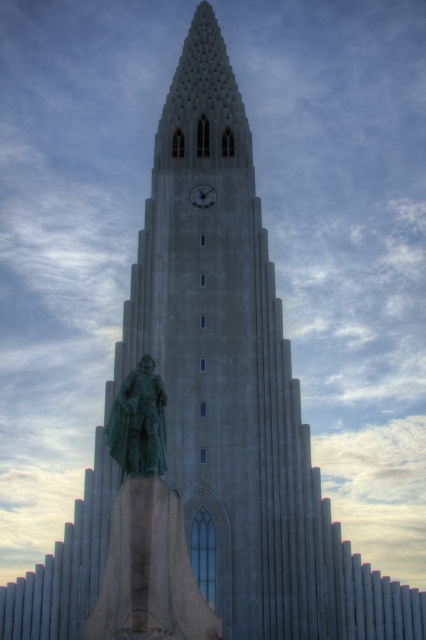
Is green patina statue at center taller than metallic gray clock at upper center?

Yes.

Between point (117, 403) and point (204, 200), which one is positioned behind?

Positioned behind is point (204, 200).

You are a GUI agent. You are given a task and a screenshot of the screen. Output one action in this format:
    pyautogui.click(x=<x>, y=<y>)
    Task: Click on the green patina statue at center
    Image resolution: width=426 pixels, height=640 pixels.
    Given the screenshot: What is the action you would take?
    pyautogui.click(x=138, y=422)

This screenshot has height=640, width=426. I want to click on green patina statue at center, so click(138, 422).